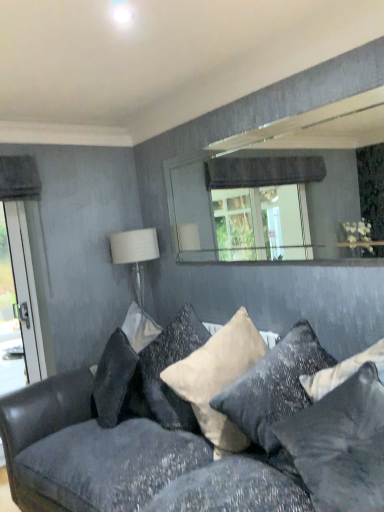
Find the location of a particular element. white fabric lampshade at upper right is located at coordinates pyautogui.click(x=135, y=254).

What do you see at coordinates (218, 378) in the screenshot?
I see `beige velvet pillow at center, which appears as the second pillow when viewed from the front` at bounding box center [218, 378].

Find the location of a particular element. textured gray curtain at upper right is located at coordinates (260, 184).

Is velvet gray pillow at center, which appears as the third pillow when viewed from the back, completely or partially inside textured gray curtain at upper right?

No, textured gray curtain at upper right does not contain velvet gray pillow at center, which appears as the third pillow when viewed from the back.

Considering the sizes of objects textured gray curtain at upper right and velvet gray pillow at center, which appears as the third pillow when viewed from the back, in the image provided, who is bigger, textured gray curtain at upper right or velvet gray pillow at center, which appears as the third pillow when viewed from the back,?

Bigger between the two is velvet gray pillow at center, which appears as the third pillow when viewed from the back.

Could you tell me if textured gray curtain at upper right is facing velvet gray pillow at center, arranged as the 1th pillow when viewed from the front?

No, textured gray curtain at upper right is not oriented towards velvet gray pillow at center, arranged as the 1th pillow when viewed from the front.

Is velvet dark gray couch at lower center inside beige velvet pillow at center, which is the 2th pillow in back-to-front order?

No, velvet dark gray couch at lower center is not inside beige velvet pillow at center, which is the 2th pillow in back-to-front order.

Is beige velvet pillow at center, which is the 2th pillow in back-to-front order, in front of or behind velvet dark gray couch at lower center in the image?

beige velvet pillow at center, which is the 2th pillow in back-to-front order, is behind velvet dark gray couch at lower center.

From the picture: From the image's perspective, between beige velvet pillow at center, which is the 2th pillow in back-to-front order, and velvet dark gray couch at lower center, which one is located above?

beige velvet pillow at center, which is the 2th pillow in back-to-front order, is shown above in the image.

From a real-world perspective, is beige velvet pillow at center, which is the 2th pillow in back-to-front order, positioned under white velvet pillow at center, which is the third pillow in front-to-back order, based on gravity?

Yes.

Is beige velvet pillow at center, which appears as the second pillow when viewed from the front, thinner than white velvet pillow at center, which is the first pillow from back to front?

No.

Is beige velvet pillow at center, which is the 2th pillow in back-to-front order, further to the viewer compared to white velvet pillow at center, which is the third pillow in front-to-back order?

No.

From a real-world perspective, who is located lower, velvet dark gray couch at lower center or beige velvet pillow at center, which appears as the second pillow when viewed from the front?

velvet dark gray couch at lower center.

Is velvet dark gray couch at lower center positioned far away from beige velvet pillow at center, which appears as the second pillow when viewed from the front?

velvet dark gray couch at lower center is actually quite close to beige velvet pillow at center, which appears as the second pillow when viewed from the front.

Can you tell me how much velvet dark gray couch at lower center and beige velvet pillow at center, which appears as the second pillow when viewed from the front, differ in facing direction?

There is a 0.000282-degree angle between the facing directions of velvet dark gray couch at lower center and beige velvet pillow at center, which appears as the second pillow when viewed from the front.

How much distance is there between velvet dark gray couch at lower center and beige velvet pillow at center, which is the 2th pillow in back-to-front order?

velvet dark gray couch at lower center is 11.48 inches away from beige velvet pillow at center, which is the 2th pillow in back-to-front order.

From a real-world perspective, between velvet gray pillow at center, arranged as the 1th pillow when viewed from the front, and textured gray curtain at upper right, who is vertically lower?

velvet gray pillow at center, arranged as the 1th pillow when viewed from the front.

Is there a large distance between velvet gray pillow at center, arranged as the 1th pillow when viewed from the front, and textured gray curtain at upper right?

velvet gray pillow at center, arranged as the 1th pillow when viewed from the front, is far away from textured gray curtain at upper right.

Is velvet gray pillow at center, which appears as the third pillow when viewed from the back, in front of or behind textured gray curtain at upper right in the image?

Clearly, velvet gray pillow at center, which appears as the third pillow when viewed from the back, is in front of textured gray curtain at upper right.

Which of these two, velvet gray pillow at center, which appears as the third pillow when viewed from the back, or textured gray curtain at upper right, is thinner?

textured gray curtain at upper right.

From the image's perspective, who appears lower, white fabric lampshade at upper right or textured gray curtain at upper right?

white fabric lampshade at upper right, from the image's perspective.

In the scene shown: Considering the sizes of objects white fabric lampshade at upper right and textured gray curtain at upper right in the image provided, who is taller, white fabric lampshade at upper right or textured gray curtain at upper right?

Standing taller between the two is white fabric lampshade at upper right.

Where is `window screen lying in front of the white fabric lampshade at upper right`? This screenshot has height=512, width=384. window screen lying in front of the white fabric lampshade at upper right is located at coordinates (260, 184).

Looking at the image, does white fabric lampshade at upper right seem bigger or smaller compared to textured gray curtain at upper right?

In the image, white fabric lampshade at upper right appears to be larger than textured gray curtain at upper right.

Could you tell me if white velvet pillow at center, which is the first pillow from back to front, is turned towards beige velvet pillow at center, which is the 2th pillow in back-to-front order?

No.

Based on the photo, is white velvet pillow at center, which is the first pillow from back to front, bigger than beige velvet pillow at center, which is the 2th pillow in back-to-front order?

Incorrect, white velvet pillow at center, which is the first pillow from back to front, is not larger than beige velvet pillow at center, which is the 2th pillow in back-to-front order.

In the image, is white velvet pillow at center, which is the first pillow from back to front, on the left side or the right side of beige velvet pillow at center, which is the 2th pillow in back-to-front order?

white velvet pillow at center, which is the first pillow from back to front, is positioned on beige velvet pillow at center, which is the 2th pillow in back-to-front order,'s left side.

In the image, is white velvet pillow at center, which is the third pillow in front-to-back order, positioned in front of or behind beige velvet pillow at center, which is the 2th pillow in back-to-front order?

Clearly, white velvet pillow at center, which is the third pillow in front-to-back order, is behind beige velvet pillow at center, which is the 2th pillow in back-to-front order.

The height and width of the screenshot is (512, 384). In order to click on pillow that is the 2nd object located in front of the textured gray curtain at upper right in this screenshot , I will do pos(341,444).

Locate an element on the screen. studio couch below the beige velvet pillow at center, which appears as the second pillow when viewed from the front (from the image's perspective) is located at coordinates (197, 441).

Which object lies further to the anchor point white fabric lampshade at upper right, textured gray curtain at upper right or white velvet pillow at center, which is the third pillow in front-to-back order?

The object further to white fabric lampshade at upper right is textured gray curtain at upper right.

From the image, which object appears to be nearer to textured gray curtain at upper right, white velvet pillow at center, which is the first pillow from back to front, or beige velvet pillow at center, which appears as the second pillow when viewed from the front?

white velvet pillow at center, which is the first pillow from back to front, is closer to textured gray curtain at upper right.

When comparing their distances from velvet dark gray couch at lower center, does white velvet pillow at center, which is the first pillow from back to front, or textured gray curtain at upper right seem closer?

Based on the image, white velvet pillow at center, which is the first pillow from back to front, appears to be nearer to velvet dark gray couch at lower center.

In the scene shown: Which object lies further to the anchor point textured gray curtain at upper right, velvet gray pillow at center, which appears as the third pillow when viewed from the back, or white fabric lampshade at upper right?

Based on the image, velvet gray pillow at center, which appears as the third pillow when viewed from the back, appears to be further to textured gray curtain at upper right.

From the image, which object appears to be nearer to velvet gray pillow at center, which appears as the third pillow when viewed from the back, beige velvet pillow at center, which appears as the second pillow when viewed from the front, or textured gray curtain at upper right?

beige velvet pillow at center, which appears as the second pillow when viewed from the front, lies closer to velvet gray pillow at center, which appears as the third pillow when viewed from the back, than the other object.

Looking at the image, which one is located further to beige velvet pillow at center, which appears as the second pillow when viewed from the front, white velvet pillow at center, which is the third pillow in front-to-back order, or velvet dark gray couch at lower center?

velvet dark gray couch at lower center is positioned further to the anchor beige velvet pillow at center, which appears as the second pillow when viewed from the front.

From the image, which object appears to be farther from velvet gray pillow at center, which appears as the third pillow when viewed from the back, white velvet pillow at center, which is the first pillow from back to front, or textured gray curtain at upper right?

Among the two, textured gray curtain at upper right is located further to velvet gray pillow at center, which appears as the third pillow when viewed from the back.

Considering their positions, is white fabric lampshade at upper right positioned closer to beige velvet pillow at center, which appears as the second pillow when viewed from the front, than textured gray curtain at upper right?

white fabric lampshade at upper right is closer to beige velvet pillow at center, which appears as the second pillow when viewed from the front.

What are the coordinates of `pillow between textured gray curtain at upper right and white fabric lampshade at upper right along the z-axis` in the screenshot? It's located at (168, 366).

Where is `window screen between beige velvet pillow at center, which appears as the second pillow when viewed from the front, and white fabric lampshade at upper right in the front-back direction`? This screenshot has width=384, height=512. window screen between beige velvet pillow at center, which appears as the second pillow when viewed from the front, and white fabric lampshade at upper right in the front-back direction is located at coordinates (260, 184).

In order to click on pillow located between beige velvet pillow at center, which appears as the second pillow when viewed from the front, and white fabric lampshade at upper right in the depth direction in this screenshot , I will do `click(168, 366)`.

Find the location of a particular element. window screen between velvet gray pillow at center, arranged as the 1th pillow when viewed from the front, and white fabric lampshade at upper right, along the z-axis is located at coordinates (260, 184).